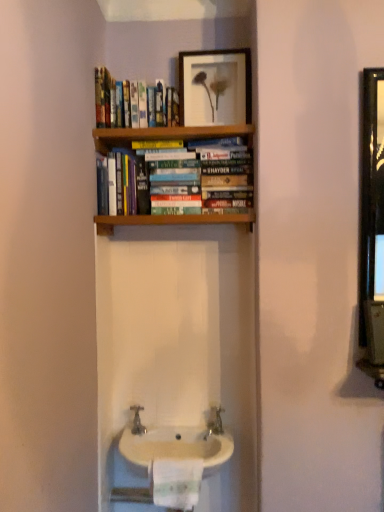
Question: From the image's perspective, is white paper towel at lower center above or below matte wooden picture frame at upper center?

Choices:
 (A) below
 (B) above

Answer: (A)

Question: From a real-world perspective, is white paper towel at lower center positioned above or below matte wooden picture frame at upper center?

Choices:
 (A) above
 (B) below

Answer: (B)

Question: Estimate the real-world distances between objects in this image. Which object is closer to the white glossy sink at lower center?

Choices:
 (A) hardcover book at center
 (B) matte wooden picture frame at upper center
 (C) hardcover books at upper center
 (D) silver metallic tap at center
 (E) white paper towel at lower center

Answer: (E)

Question: Estimate the real-world distances between objects in this image. Which object is farther from the silver metallic tap at center?

Choices:
 (A) matte wooden picture frame at upper center
 (B) hardcover books at upper center
 (C) white paper towel at lower center
 (D) hardcover book at center
 (E) white glossy sink at lower center

Answer: (A)